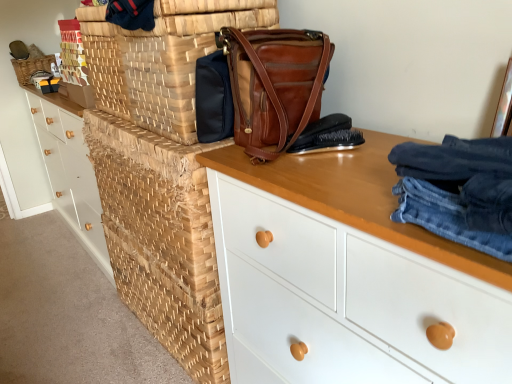
Image resolution: width=512 pixels, height=384 pixels. I want to click on free location in front of brown leather brush at center, so click(334, 177).